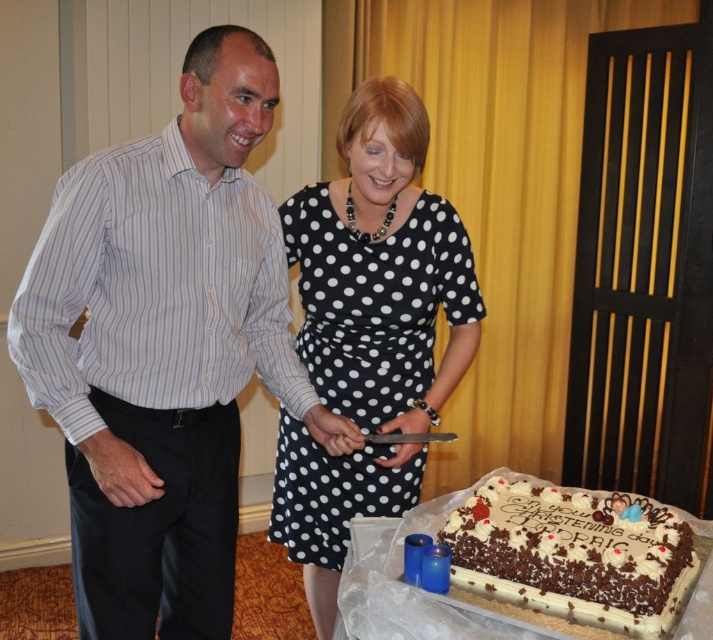
Consider the image. You are a photographer at the event and want to capture both the white striped shirt at left and the white frosted chocolate cake at lower right in the same frame. Based on their sizes, which one should you focus on to ensure both fit clearly?

The white striped shirt at left might be wider than the white frosted chocolate cake at lower right, so focusing on the shirt would ensure both fit clearly as it is likely the wider object.

You are a photographer at a birthday party and need to capture a photo of the black dotted dress at center and the white frosted chocolate cake at lower right. The cake has a message that needs to be clearly visible. Based on their positions, will the dress block the cake in the photo?

The black dotted dress at center is positioned over the white frosted chocolate cake at lower right, so it will block the cake in the photo and the message won not be clearly visible.

You are standing at the center of the room and want to hand a gift to the person wearing the white striped shirt at left. In which direction should you move to reach them?

The white striped shirt at left is located at point 0.544 on the x axis and 0.231 on the y axis. Since you are at the center of the room, you should move towards the left and slightly forward to reach the white striped shirt at left.